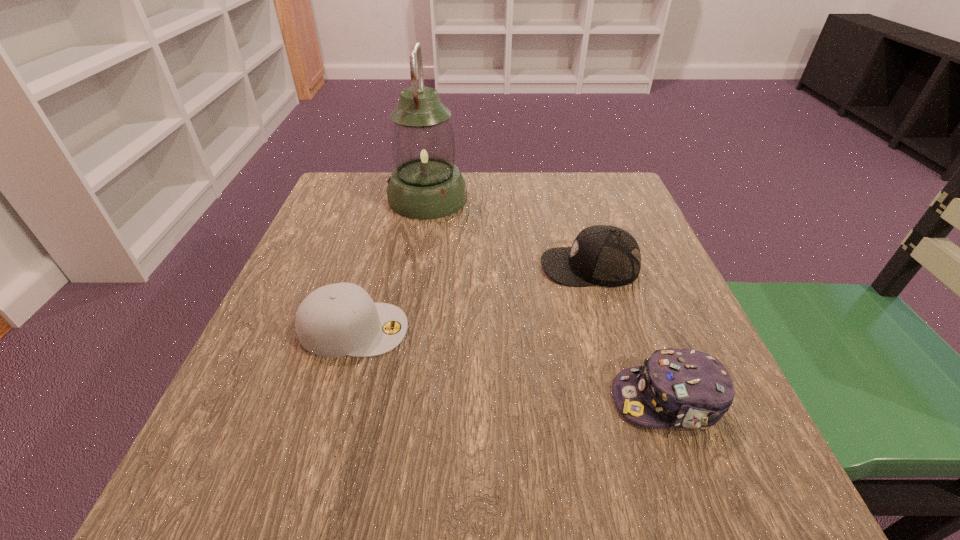
Identify the location of vacant space located 0.210m on the front-facing side of the leftmost headwear. (528, 329).

At what (x,y) coordinates should I click in order to perform the action: click on vacant space situated on the front-facing side of the nearest headwear. Please return your answer as a coordinate pair (x, y). The height and width of the screenshot is (540, 960). Looking at the image, I should click on (533, 400).

This screenshot has width=960, height=540. I want to click on free space located 0.080m on the front-facing side of the nearest headwear, so click(560, 400).

This screenshot has height=540, width=960. In order to click on vacant space located 0.050m on the front-facing side of the nearest headwear in this screenshot , I will do `click(580, 400)`.

Locate an element on the screen. This screenshot has height=540, width=960. object at the far edge is located at coordinates (426, 184).

Where is `lantern at the left edge`? The image size is (960, 540). lantern at the left edge is located at coordinates (426, 184).

I want to click on cap situated at the left edge, so point(336,320).

Where is `object that is at the far left corner`? The width and height of the screenshot is (960, 540). object that is at the far left corner is located at coordinates (426, 184).

In the image, there is a desktop. Identify the location of vacant space at the far edge. The width and height of the screenshot is (960, 540). (497, 191).

Identify the location of vacant area at the left edge of the desktop. (304, 248).